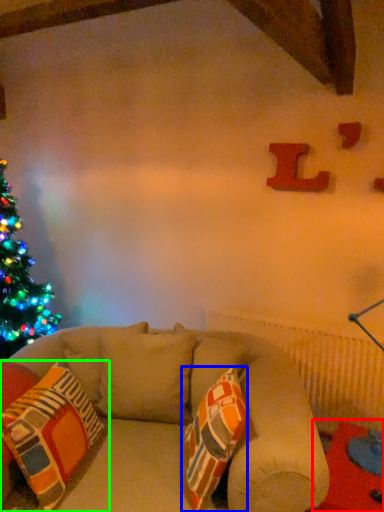
Question: Based on their relative distances, which object is nearer to table (highlighted by a red box)? Choose from throw pillow (highlighted by a blue box) and pillow (highlighted by a green box).

Choices:
 (A) throw pillow
 (B) pillow

Answer: (A)